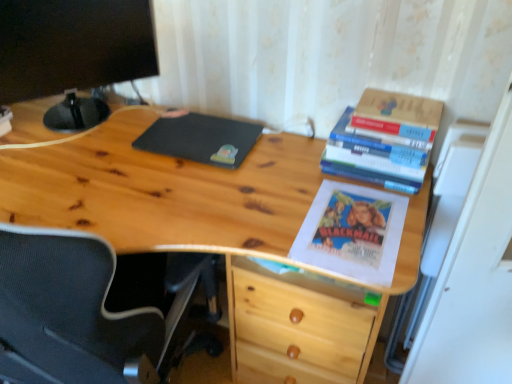
At what (x,y) coordinates should I click in order to perform the action: click on vacant space to the right of black matte mousepad at center. Please return your answer as a coordinate pair (x, y). Looking at the image, I should click on (286, 158).